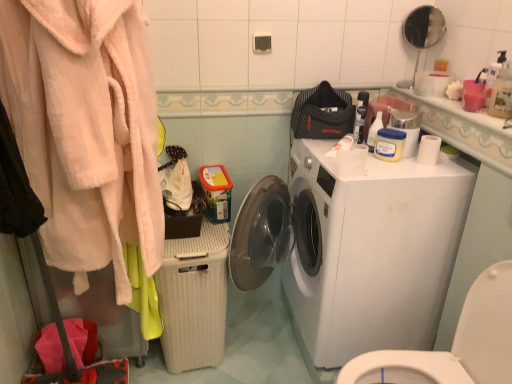
The height and width of the screenshot is (384, 512). Describe the element at coordinates (454, 343) in the screenshot. I see `white plastic washer at right` at that location.

What do you see at coordinates (502, 93) in the screenshot? I see `translucent plastic spray bottle at upper right, acting as the first cleaning product starting from the right` at bounding box center [502, 93].

What is the approximate width of beige wicker basket at lower center?

18.19 inches.

The height and width of the screenshot is (384, 512). Describe the element at coordinates (429, 150) in the screenshot. I see `white matte toilet paper at upper right` at that location.

From the picture: How much space does translucent plastic spray bottle at upper right, positioned as the 2th cleaning product in front-to-back order, occupy vertically?

The height of translucent plastic spray bottle at upper right, positioned as the 2th cleaning product in front-to-back order, is 6.37 inches.

Measure the distance between translucent plastic spray bottle at upper right, positioned as the 2th cleaning product in front-to-back order, and camera.

translucent plastic spray bottle at upper right, positioned as the 2th cleaning product in front-to-back order, is 5.20 feet away from camera.

Locate an element on the screen. Image resolution: width=512 pixels, height=384 pixels. white plastic washer at right is located at coordinates (454, 343).

Can white glossy washing machine at center be found inside white plastic washer at right?

No, white plastic washer at right does not contain white glossy washing machine at center.

Would you say white plastic washer at right is to the left or to the right of white glossy washing machine at center in the picture?

white plastic washer at right is to the right of white glossy washing machine at center.

Considering the relative sizes of white plastic washer at right and white glossy washing machine at center in the image provided, is white plastic washer at right thinner than white glossy washing machine at center?

Correct, the width of white plastic washer at right is less than that of white glossy washing machine at center.

Considering the sizes of objects white plastic washer at right and white glossy washing machine at center in the image provided, who is shorter, white plastic washer at right or white glossy washing machine at center?

With less height is white plastic washer at right.

Considering the positions of objects white matte toilet paper at upper right and translucent plastic spray bottle at upper right, the second cleaning product in the right-to-left sequence, in the image provided, who is more to the left, white matte toilet paper at upper right or translucent plastic spray bottle at upper right, the second cleaning product in the right-to-left sequence,?

From the viewer's perspective, translucent plastic spray bottle at upper right, the second cleaning product in the right-to-left sequence, appears more on the left side.

How much distance is there between white matte toilet paper at upper right and translucent plastic spray bottle at upper right, positioned as the first cleaning product in back-to-front order?

They are 7.84 inches apart.

Which of these two, white matte toilet paper at upper right or translucent plastic spray bottle at upper right, placed as the first cleaning product when sorted from left to right, stands taller?

With more height is translucent plastic spray bottle at upper right, placed as the first cleaning product when sorted from left to right.

Is translucent plastic spray bottle at upper right, placed as the first cleaning product when sorted from left to right, at the back of white matte toilet paper at upper right?

No, translucent plastic spray bottle at upper right, placed as the first cleaning product when sorted from left to right, is not at the back of white matte toilet paper at upper right.

Is point (377, 130) more distant than point (511, 307)?

Yes.

Is translucent plastic spray bottle at upper right, placed as the first cleaning product when sorted from left to right, turned away from white plastic washer at right?

No, translucent plastic spray bottle at upper right, placed as the first cleaning product when sorted from left to right, is not facing away from white plastic washer at right.

Where is `washer directly beneath the translucent plastic spray bottle at upper right, positioned as the first cleaning product in back-to-front order (from a real-world perspective)`? Image resolution: width=512 pixels, height=384 pixels. washer directly beneath the translucent plastic spray bottle at upper right, positioned as the first cleaning product in back-to-front order (from a real-world perspective) is located at coordinates (454, 343).

Which is behind, translucent plastic spray bottle at upper right, positioned as the 2th cleaning product in front-to-back order, or white plastic washer at right?

translucent plastic spray bottle at upper right, positioned as the 2th cleaning product in front-to-back order, is behind.

Which is more to the right, soft pink plush robe at left or translucent plastic spray bottle at upper right, positioned as the first cleaning product in back-to-front order?

Positioned to the right is translucent plastic spray bottle at upper right, positioned as the first cleaning product in back-to-front order.

From the picture: Is soft pink plush robe at left not close to translucent plastic spray bottle at upper right, the second cleaning product in the right-to-left sequence?

Actually, soft pink plush robe at left and translucent plastic spray bottle at upper right, the second cleaning product in the right-to-left sequence, are a little close together.

Find the location of a particular element. This screenshot has height=384, width=512. cleaning product that is the 1st one when counting upward from the soft pink plush robe at left (from the image's perspective) is located at coordinates (374, 131).

How different are the orientations of soft pink plush robe at left and translucent plastic spray bottle at upper right, positioned as the first cleaning product in back-to-front order, in degrees?

The angular difference between soft pink plush robe at left and translucent plastic spray bottle at upper right, positioned as the first cleaning product in back-to-front order, is 46.4 degrees.

Based on the photo, relative to translucent plastic spray bottle at upper right, the second cleaning product in the right-to-left sequence, is matte plastic container at upper right in front or behind?

In the image, matte plastic container at upper right appears in front of translucent plastic spray bottle at upper right, the second cleaning product in the right-to-left sequence.

Considering the sizes of matte plastic container at upper right and translucent plastic spray bottle at upper right, the second cleaning product in the right-to-left sequence, in the image, is matte plastic container at upper right taller or shorter than translucent plastic spray bottle at upper right, the second cleaning product in the right-to-left sequence,?

In the image, matte plastic container at upper right appears to be taller than translucent plastic spray bottle at upper right, the second cleaning product in the right-to-left sequence.

Which is more to the right, matte plastic container at upper right or translucent plastic spray bottle at upper right, placed as the first cleaning product when sorted from left to right?

From the viewer's perspective, matte plastic container at upper right appears more on the right side.

From the image's perspective, is matte plastic container at upper right positioned above or below translucent plastic spray bottle at upper right, positioned as the first cleaning product in back-to-front order?

Based on their image positions, matte plastic container at upper right is located beneath translucent plastic spray bottle at upper right, positioned as the first cleaning product in back-to-front order.

Does point (194, 250) appear closer or farther from the camera than point (393, 115)?

Point (194, 250) is closer to the camera than point (393, 115).

Considering the sizes of beige wicker basket at lower center and matte plastic container at upper right in the image, is beige wicker basket at lower center taller or shorter than matte plastic container at upper right?

In the image, beige wicker basket at lower center appears to be taller than matte plastic container at upper right.

In the scene shown: Is beige wicker basket at lower center in front of or behind matte plastic container at upper right in the image?

Visually, beige wicker basket at lower center is located behind matte plastic container at upper right.

From a real-world perspective, which is physically above, beige wicker basket at lower center or matte plastic container at upper right?

matte plastic container at upper right.

Is translucent plastic spray bottle at upper right, positioned as the 2th cleaning product in front-to-back order, wider than beige wicker basket at lower center?

Incorrect, the width of translucent plastic spray bottle at upper right, positioned as the 2th cleaning product in front-to-back order, does not surpass that of beige wicker basket at lower center.

Does translucent plastic spray bottle at upper right, placed as the first cleaning product when sorted from left to right, have a larger size compared to beige wicker basket at lower center?

No, translucent plastic spray bottle at upper right, placed as the first cleaning product when sorted from left to right, is not bigger than beige wicker basket at lower center.

Is translucent plastic spray bottle at upper right, placed as the first cleaning product when sorted from left to right, positioned with its back to beige wicker basket at lower center?

translucent plastic spray bottle at upper right, placed as the first cleaning product when sorted from left to right, is not turned away from beige wicker basket at lower center.

From a real-world perspective, is translucent plastic spray bottle at upper right, positioned as the 2th cleaning product in front-to-back order, on top of beige wicker basket at lower center?

Yes, from a real-world perspective, translucent plastic spray bottle at upper right, positioned as the 2th cleaning product in front-to-back order, is above beige wicker basket at lower center.

At what (x,y) coordinates should I click in order to perform the action: click on washing machine on the left side of white plastic washer at right. Please return your answer as a coordinate pair (x, y). The height and width of the screenshot is (384, 512). Looking at the image, I should click on (371, 251).

Locate an element on the screen. cleaning product behind the white matte toilet paper at upper right is located at coordinates (374, 131).

Based on their spatial positions, is beige wicker basket at lower center or soft pink plush robe at left further from white matte toilet paper at upper right?

soft pink plush robe at left is further to white matte toilet paper at upper right.

Based on their spatial positions, is translucent plastic spray bottle at upper right, the second cleaning product in the right-to-left sequence, or translucent plastic spray bottle at upper right, which appears as the 2th cleaning product when viewed from the back, closer to white glossy washing machine at center?

Among the two, translucent plastic spray bottle at upper right, the second cleaning product in the right-to-left sequence, is located nearer to white glossy washing machine at center.

When comparing their distances from white matte toilet paper at upper right, does translucent plastic spray bottle at upper right, the second cleaning product in the right-to-left sequence, or beige wicker basket at lower center seem closer?

The object closer to white matte toilet paper at upper right is translucent plastic spray bottle at upper right, the second cleaning product in the right-to-left sequence.

In the scene shown: Which object lies nearer to the anchor point matte plastic container at upper right, soft pink plush robe at left or white glossy washing machine at center?

Among the two, white glossy washing machine at center is located nearer to matte plastic container at upper right.

Based on their spatial positions, is beige wicker basket at lower center or white matte toilet paper at upper right closer to translucent plastic spray bottle at upper right, positioned as the 2th cleaning product in front-to-back order?

white matte toilet paper at upper right lies closer to translucent plastic spray bottle at upper right, positioned as the 2th cleaning product in front-to-back order, than the other object.

Estimate the real-world distances between objects in this image. Which object is closer to matte plastic container at upper right, soft pink plush robe at left or beige wicker basket at lower center?

The object closer to matte plastic container at upper right is beige wicker basket at lower center.

Considering their positions, is beige wicker basket at lower center positioned closer to translucent plastic spray bottle at upper right, acting as the first cleaning product starting from the right, than matte plastic container at upper right?

The object closer to translucent plastic spray bottle at upper right, acting as the first cleaning product starting from the right, is matte plastic container at upper right.

When comparing their distances from beige wicker basket at lower center, does soft pink plush robe at left or white glossy washing machine at center seem closer?

The object closer to beige wicker basket at lower center is white glossy washing machine at center.

At what (x,y) coordinates should I click in order to perform the action: click on dish washer between soft pink plush robe at left and white glossy washing machine at center from left to right. Please return your answer as a coordinate pair (x, y). Looking at the image, I should click on (194, 298).

In order to click on toilet paper located between matte plastic container at upper right and translucent plastic spray bottle at upper right, which is counted as the 1th cleaning product, starting from the front, in the left-right direction in this screenshot , I will do `click(429, 150)`.

At what (x,y) coordinates should I click in order to perform the action: click on washing machine located between soft pink plush robe at left and matte plastic container at upper right in the left-right direction. Please return your answer as a coordinate pair (x, y). The height and width of the screenshot is (384, 512). Looking at the image, I should click on (371, 251).

Where is `cleaning product located between beige wicker basket at lower center and translucent plastic spray bottle at upper right, acting as the first cleaning product starting from the right, in the left-right direction`? The image size is (512, 384). cleaning product located between beige wicker basket at lower center and translucent plastic spray bottle at upper right, acting as the first cleaning product starting from the right, in the left-right direction is located at coordinates (374, 131).